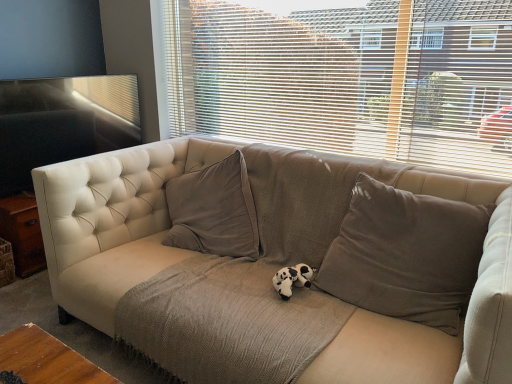
Question: Is brown fabric pillow at center closer to the viewer compared to beige fabric couch at center?

Choices:
 (A) no
 (B) yes

Answer: (A)

Question: Does brown fabric pillow at center turn towards beige fabric couch at center?

Choices:
 (A) yes
 (B) no

Answer: (B)

Question: From a real-world perspective, is brown fabric pillow at center over beige fabric couch at center?

Choices:
 (A) yes
 (B) no

Answer: (A)

Question: Is brown fabric pillow at center wider than beige fabric couch at center?

Choices:
 (A) no
 (B) yes

Answer: (A)

Question: Can you confirm if brown fabric pillow at center is thinner than beige fabric couch at center?

Choices:
 (A) no
 (B) yes

Answer: (B)

Question: Is brown fabric pillow at center oriented away from beige fabric couch at center?

Choices:
 (A) yes
 (B) no

Answer: (B)

Question: Could beige fabric blinds at upper center be considered to be inside black plush toy at center?

Choices:
 (A) no
 (B) yes

Answer: (A)

Question: Would you say black plush toy at center is a long distance from beige fabric blinds at upper center?

Choices:
 (A) yes
 (B) no

Answer: (A)

Question: From the image's perspective, is black plush toy at center over beige fabric blinds at upper center?

Choices:
 (A) yes
 (B) no

Answer: (B)

Question: Considering the relative positions of black plush toy at center and beige fabric blinds at upper center in the image provided, is black plush toy at center to the left of beige fabric blinds at upper center from the viewer's perspective?

Choices:
 (A) yes
 (B) no

Answer: (A)

Question: Is black plush toy at center further to camera compared to beige fabric blinds at upper center?

Choices:
 (A) yes
 (B) no

Answer: (B)

Question: Is black plush toy at center looking in the opposite direction of beige fabric blinds at upper center?

Choices:
 (A) yes
 (B) no

Answer: (B)

Question: From the image's perspective, is beige fabric blinds at upper center on beige fabric couch at center?

Choices:
 (A) no
 (B) yes

Answer: (B)